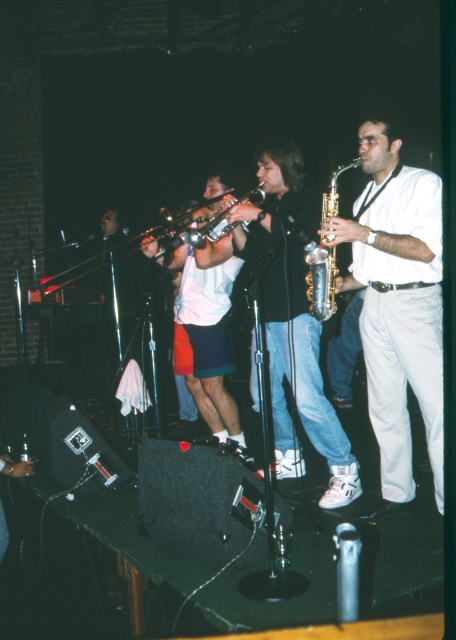
Question: Does white matte saxophone at center appear under shiny silver trumpet at center?

Choices:
 (A) no
 (B) yes

Answer: (B)

Question: Which of the following is the farthest from the observer?

Choices:
 (A) (331, 189)
 (B) (294, 266)

Answer: (B)

Question: Based on their relative distances, which object is nearer to the white matte saxophone at center?

Choices:
 (A) shiny brass trumpet at center
 (B) shiny silver trumpet at center

Answer: (A)

Question: Can you confirm if black matte jacket at center is positioned below shiny silver trumpet at center?

Choices:
 (A) yes
 (B) no

Answer: (A)

Question: Which of the following is the farthest from the observer?

Choices:
 (A) (202, 230)
 (B) (395, 365)
 (C) (300, 292)

Answer: (A)

Question: Is black matte jacket at center thinner than shiny brass trumpet at center?

Choices:
 (A) no
 (B) yes

Answer: (A)